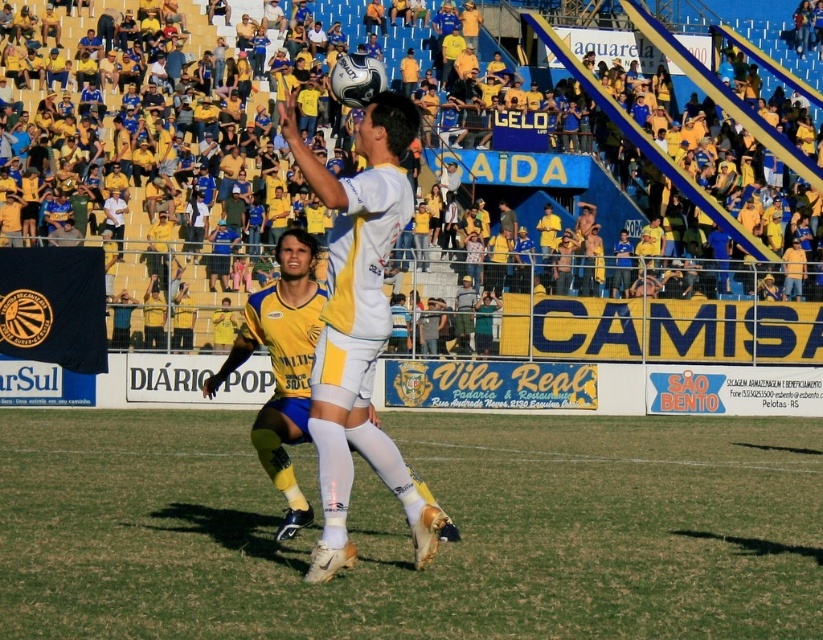
You are a soccer coach analyzing the match. You notice the white matte soccer player at center and the green grass at center. Which object is positioned lower in the image?

The green grass at center is located below the white matte soccer player at center, so the green grass at center is positioned lower in the image.

You are a drone operator trying to capture a close shot of the white matte soccer player at center and the green grass at center from above. Which one will appear taller in the footage?

The white matte soccer player at center appears taller than the green grass at center in the footage because the green grass at center is shorter than the white matte soccer player at center.

What is the exact coordinate of the green grass at center in the image?

The green grass at center is located at point (407, 532).